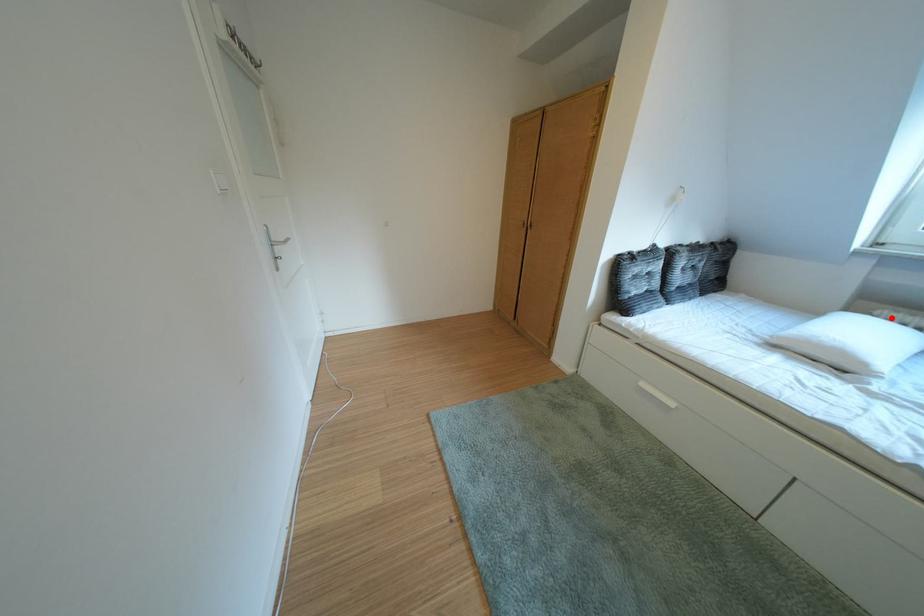
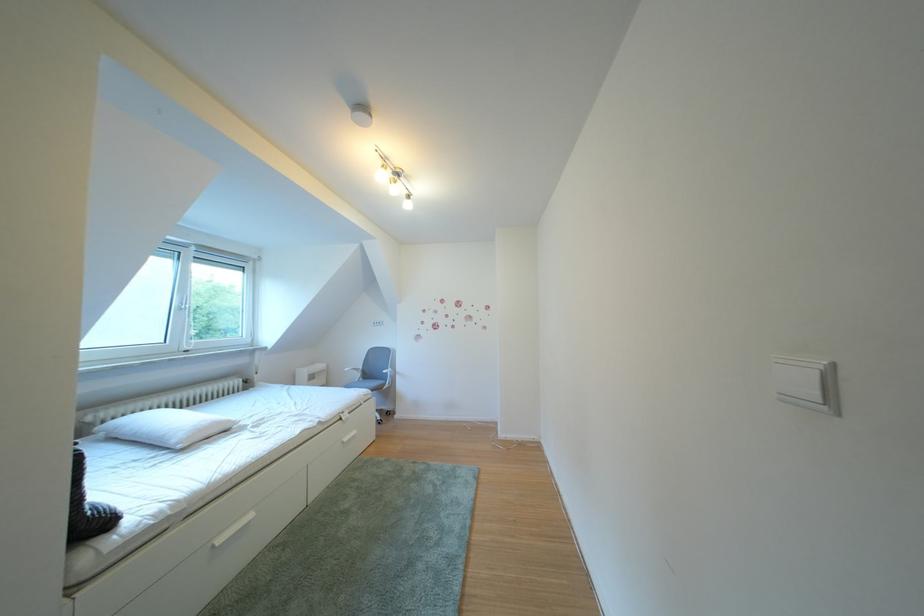
Question: I am providing you with two images of the same scene from different viewpoints. In image1, a red point is highlighted. Considering the same 3D point in image2, which of the following is correct?

Choices:
 (A) It is closer
 (B) It is farther

Answer: (B)